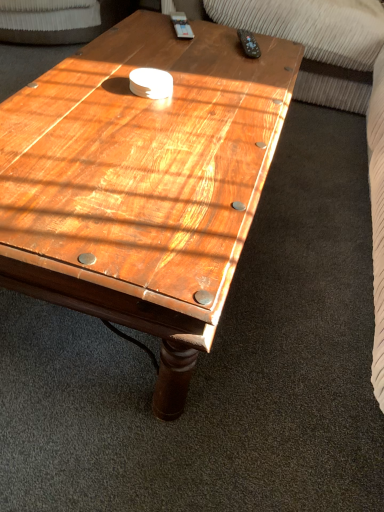
The height and width of the screenshot is (512, 384). Identify the location of vacant space positioned to the left of black plastic remote at upper right. (200, 51).